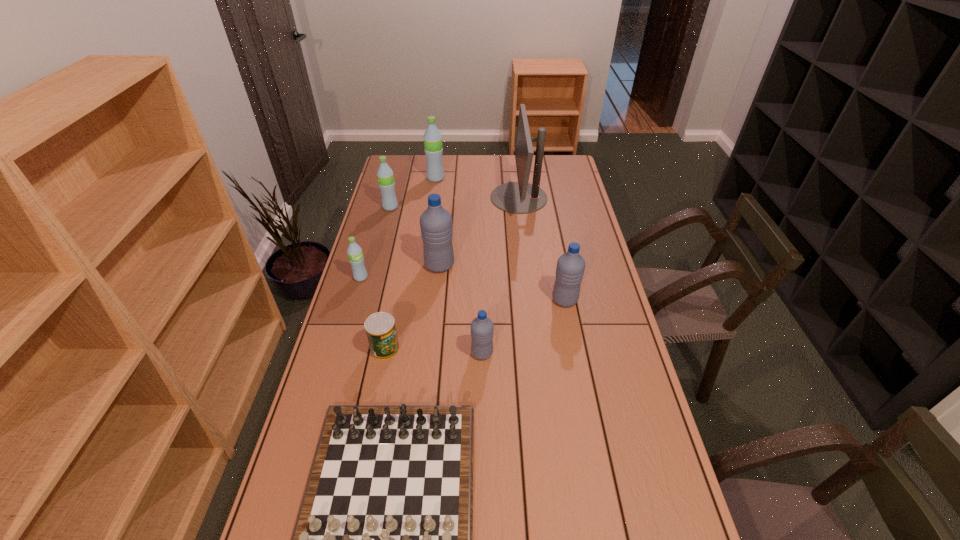
This screenshot has height=540, width=960. I want to click on vacant space at the left edge, so click(x=378, y=241).

Where is `vacant space at the right edge`? vacant space at the right edge is located at coordinates (557, 222).

In the image, there is a desktop. Identify the location of vacant region at the far right corner. The height and width of the screenshot is (540, 960). (562, 166).

Find the location of a particular element. Image resolution: width=960 pixels, height=540 pixels. unoccupied position between the farthest green water bottle and the gray computer monitor is located at coordinates (477, 188).

Find the location of a particular element. This screenshot has height=540, width=960. unoccupied area between the nearest green water bottle and the farthest blue water bottle is located at coordinates (400, 271).

Where is `empty space between the second farthest water bottle and the nearest water bottle`? empty space between the second farthest water bottle and the nearest water bottle is located at coordinates (436, 280).

At what (x,y) coordinates should I click in order to perform the action: click on object that stands as the fourth closest to the biggest green water bottle. Please return your answer as a coordinate pair (x, y). The image size is (960, 540). Looking at the image, I should click on (356, 259).

At what (x,y) coordinates should I click in order to perform the action: click on object that can be found as the second closest to the nearest object. Please return your answer as a coordinate pair (x, y). This screenshot has height=540, width=960. Looking at the image, I should click on (380, 328).

The height and width of the screenshot is (540, 960). I want to click on water bottle object that ranks as the third closest to the smallest green water bottle, so click(482, 328).

At what (x,y) coordinates should I click in order to perform the action: click on water bottle that is the closest to the nearest object. Please return your answer as a coordinate pair (x, y). Image resolution: width=960 pixels, height=540 pixels. Looking at the image, I should click on (482, 328).